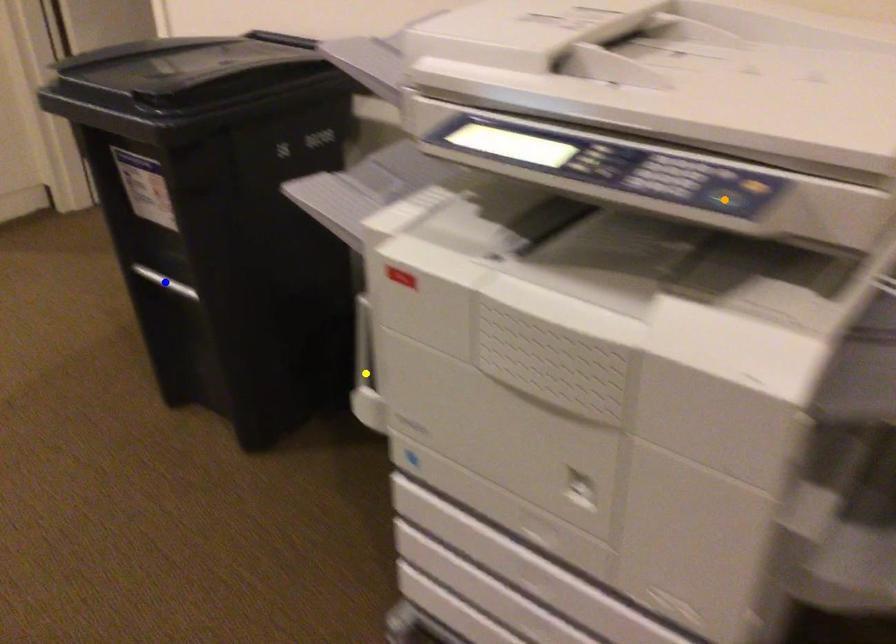
Order these from nearest to farthest:
A) yellow point
B) orange point
C) blue point

orange point, yellow point, blue point